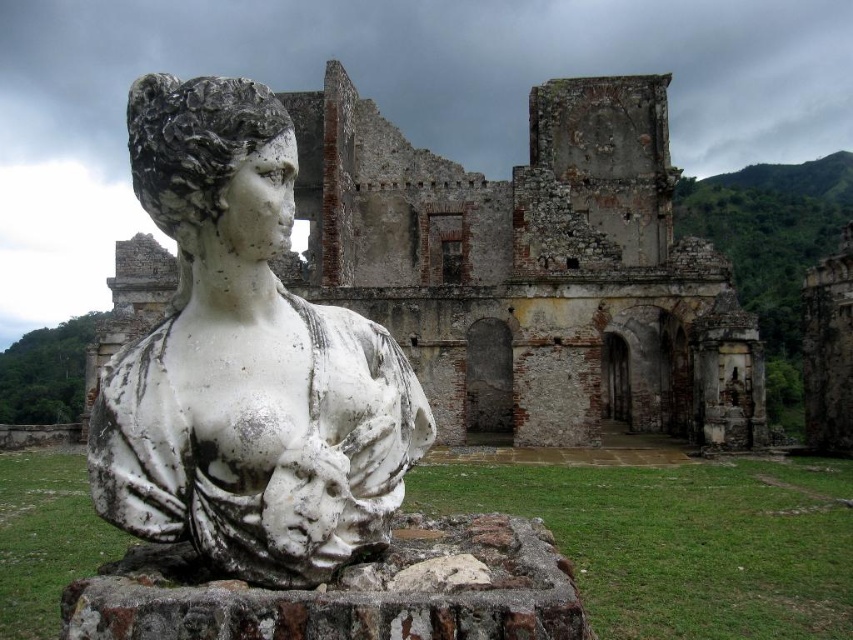
Is weathered stone ruins at center shorter than white marble bust at center?

No, weathered stone ruins at center is not shorter than white marble bust at center.

Is weathered stone ruins at center taller than white marble bust at center?

Yes, weathered stone ruins at center is taller than white marble bust at center.

Which is in front, point (610, 115) or point (311, 481)?

Point (311, 481)

In order to click on weathered stone ruins at center in this screenshot , I will do `click(531, 269)`.